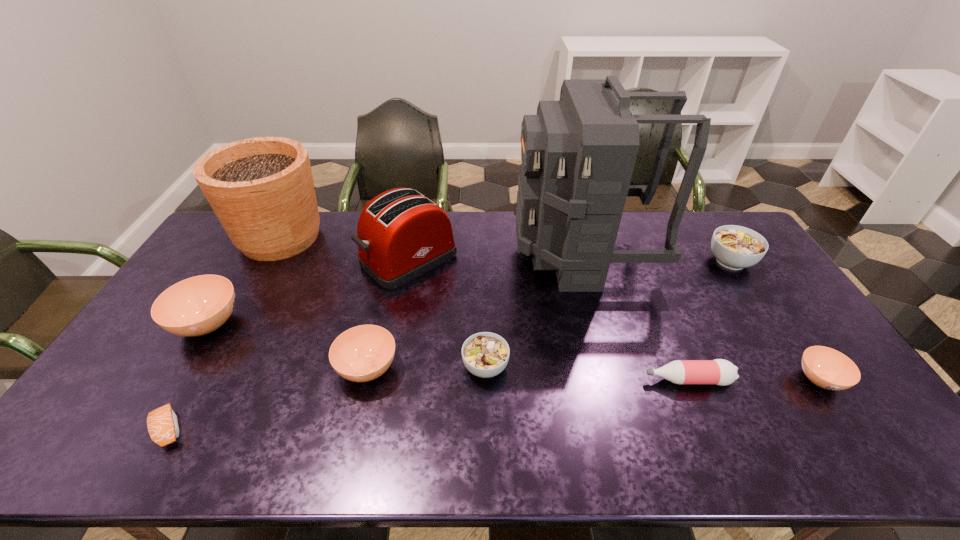
At what (x,y) coordinates should I click in order to perform the action: click on vacant space located 0.120m on the front compartment of the gray backpack. Please return your answer as a coordinate pair (x, y). Image resolution: width=960 pixels, height=540 pixels. Looking at the image, I should click on (480, 252).

Where is `free space located on the front of the flowerpot`? Image resolution: width=960 pixels, height=540 pixels. free space located on the front of the flowerpot is located at coordinates (252, 288).

Where is `vacant space situated on the back of the eighth shortest object`? vacant space situated on the back of the eighth shortest object is located at coordinates (416, 221).

In order to click on vacant space located on the front of the leftmost peach soup bowl in this screenshot , I will do `click(159, 402)`.

Locate an element on the screen. The image size is (960, 540). free space located on the front of the farthest soup bowl is located at coordinates (774, 327).

What are the coordinates of `blank space located on the left of the fourth soup bowl from right to left` in the screenshot? It's located at (240, 368).

Where is `free space located on the right of the smaller white soup bowl`? free space located on the right of the smaller white soup bowl is located at coordinates (641, 367).

In order to click on vacant space located 0.220m with the cap open on the bottle in this screenshot , I will do `click(561, 380)`.

What are the coordinates of `free point located 0.200m with the cap open on the bottle` in the screenshot? It's located at (568, 380).

The width and height of the screenshot is (960, 540). I want to click on free space located with the cap open on the bottle, so click(602, 380).